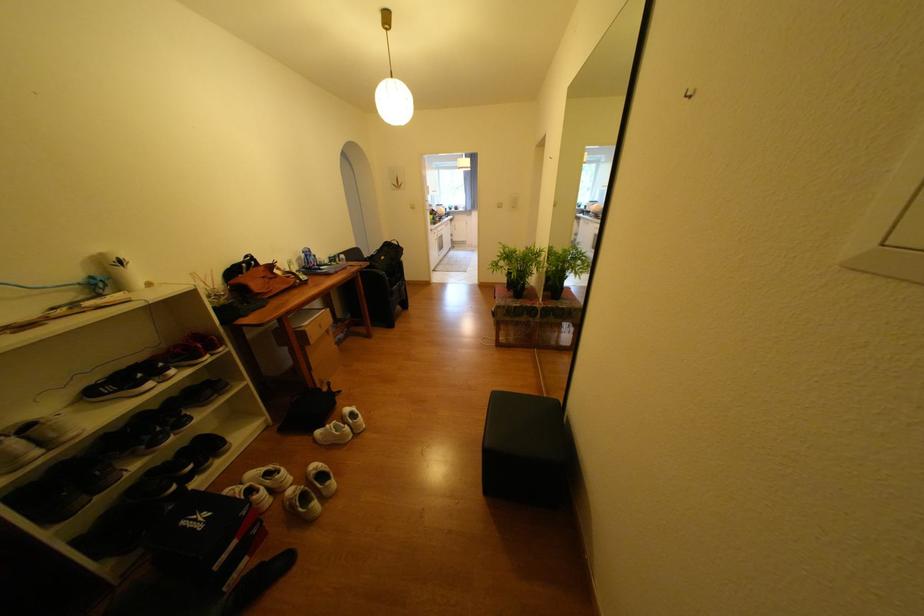
Where is `light switch button`? This screenshot has height=616, width=924. light switch button is located at coordinates (906, 224).